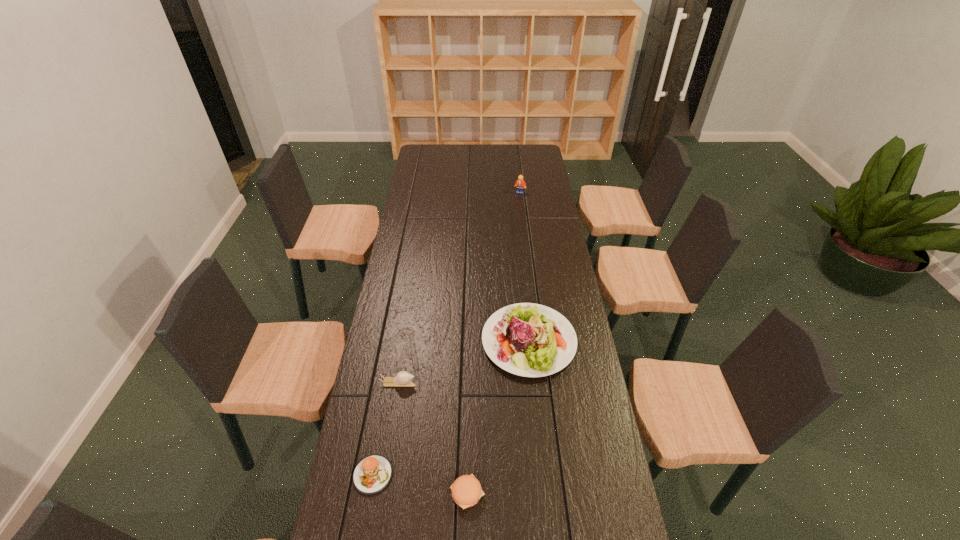
Where is `free space located 0.130m on the left of the right patty`? The image size is (960, 540). free space located 0.130m on the left of the right patty is located at coordinates (401, 493).

This screenshot has height=540, width=960. In order to click on escargot present at the left edge in this screenshot , I will do `click(403, 379)`.

Where is `patty that is at the left edge`? Image resolution: width=960 pixels, height=540 pixels. patty that is at the left edge is located at coordinates (372, 474).

This screenshot has height=540, width=960. In order to click on Lego that is at the right edge in this screenshot , I will do `click(520, 184)`.

Image resolution: width=960 pixels, height=540 pixels. I want to click on salad plate that is at the right edge, so click(526, 339).

Where is `vacant space at the left edge of the desktop`? vacant space at the left edge of the desktop is located at coordinates (393, 328).

In the image, there is a desktop. Find the location of `vacant space at the right edge`. vacant space at the right edge is located at coordinates (537, 174).

The height and width of the screenshot is (540, 960). Identify the location of vacant region at the far left corner. (419, 153).

In the image, there is a desktop. Identify the location of vacant space at the far right corner. click(517, 163).

The width and height of the screenshot is (960, 540). What are the coordinates of `vacant space that is in between the escargot and the Lego` in the screenshot? It's located at (459, 288).